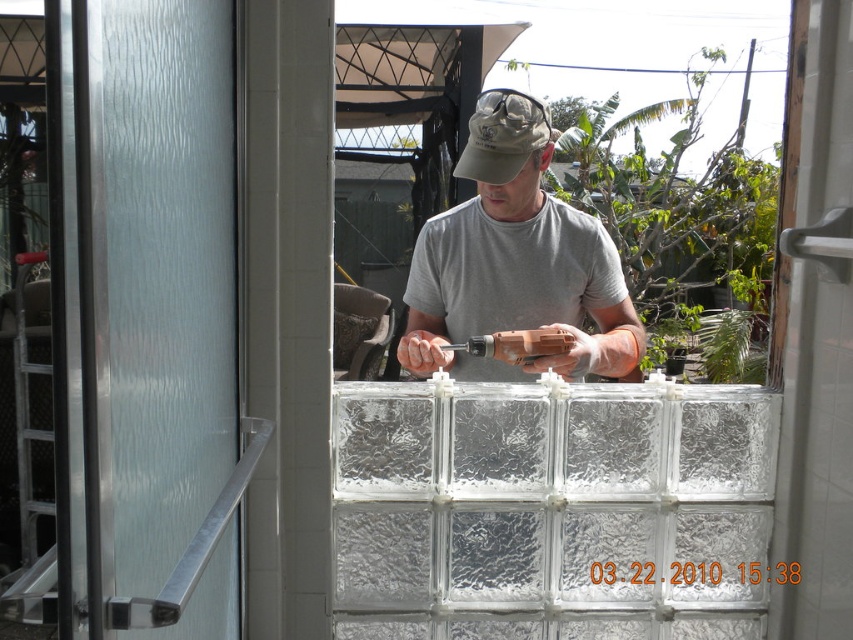
You are a safety inspector observing the construction worker. You notice the gray matte shirt at center and the orange plastic drill at center. Which object is positioned more to the left?

The orange plastic drill at center is positioned more to the left than the gray matte shirt at center because the gray matte shirt at center is to the right of orange plastic drill at center.